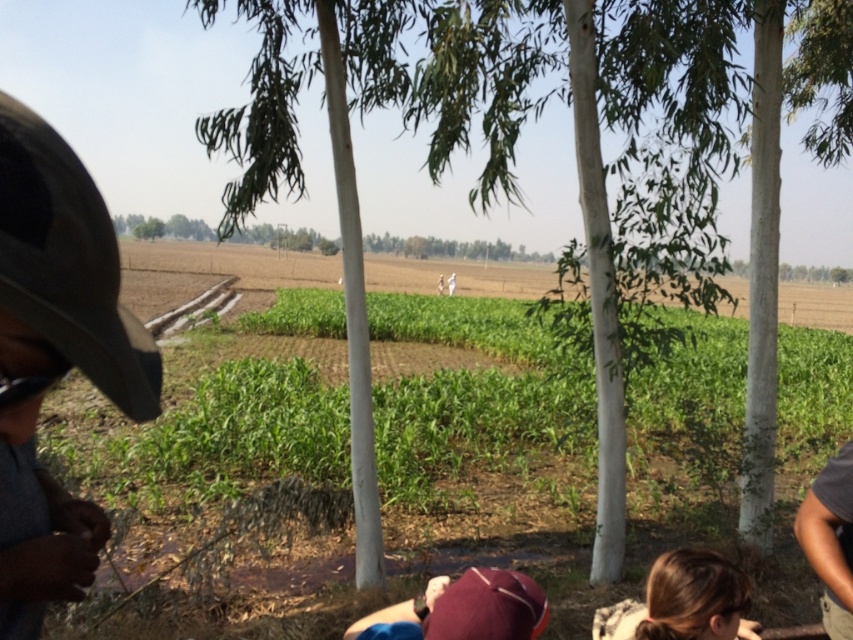
You are standing at the point marked as point (577,170) in the image. What object is directly in front of you?

The green leafy tree at center is located at point (577,170), so the object directly in front of you is the green leafy tree at center.

You are standing in the rural scene and want to take a photo of the green leafy tree at center without the blonde hair at lower right appearing in the shot. Which direction should you move to achieve this?

Move to the left so that the green leafy tree at center is positioned away from the blonde hair at lower right, which is to its left.

You are standing in the rural scene under the eucalyptus trees. You see two points marked in the image. Which point is closer to you, point (634, 72) or point (831, 532)?

Point (634, 72) is closer to you because it is further to the camera than point (831, 532).